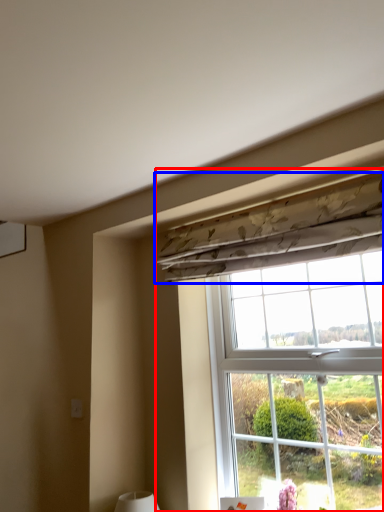
Question: Which of the following is the closest to the observer, window (highlighted by a red box) or curtain (highlighted by a blue box)?

Choices:
 (A) window
 (B) curtain

Answer: (A)